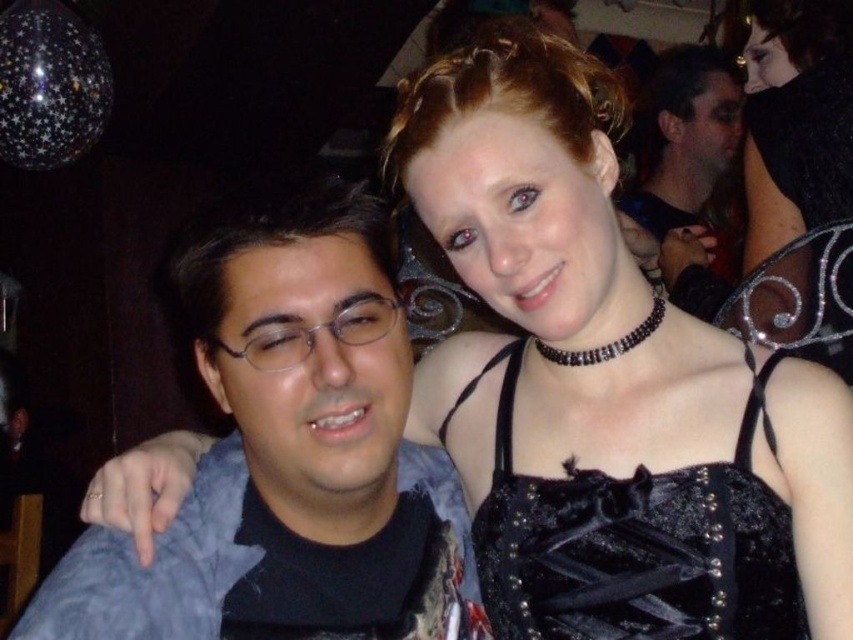
You are a photographer at the party and want to adjust the lighting so that the blue fabric shirt at left and the matte black hair at upper right are both clearly visible. Which object should you focus on first to ensure proper exposure?

The blue fabric shirt at left is below matte black hair at upper right, so you should focus on the matte black hair at upper right first to ensure proper exposure since it is higher in the frame.

Looking at this image, you are taking a photo of the two people in the scene. You want to focus on the person closer to the camera. Which point should you focus on, point (256, 500) or point (590, 625)?

Point (256, 500) is further to the camera than point (590, 625), so you should focus on point (256, 500) to capture the person closer to the camera.

You are a photographer at the party and want to adjust the lighting so that the black velvet dress at upper right and the matte black hair at upper right are both visible. Which object should you focus on first to ensure proper exposure?

The black velvet dress at upper right is below matte black hair at upper right. Since the dress is positioned lower, it might be in shadow if the hair is lit properly. Focus on the matte black hair at upper right first to ensure it isn not overexposed, then adjust for the dress.